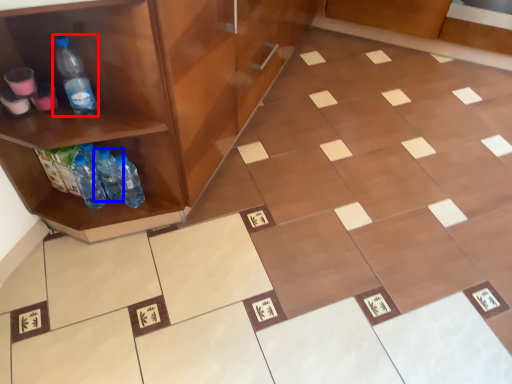
Question: Which of the following is the closest to the observer, bottle (highlighted by a red box) or bottle (highlighted by a blue box)?

Choices:
 (A) bottle
 (B) bottle

Answer: (A)